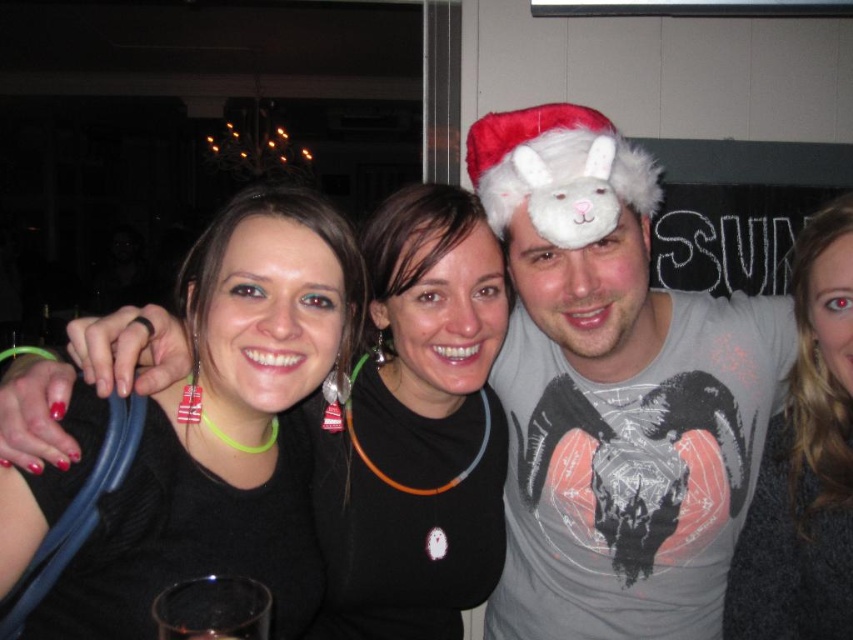
You are at a party and want to borrow a hat from someone. You see the gray fuzzy sweater at upper right and the fuzzy white hat at center. Which one is wider so you can decide if it might fit your head?

The fuzzy white hat at center is wider than the gray fuzzy sweater at upper right, so it might fit your head better.